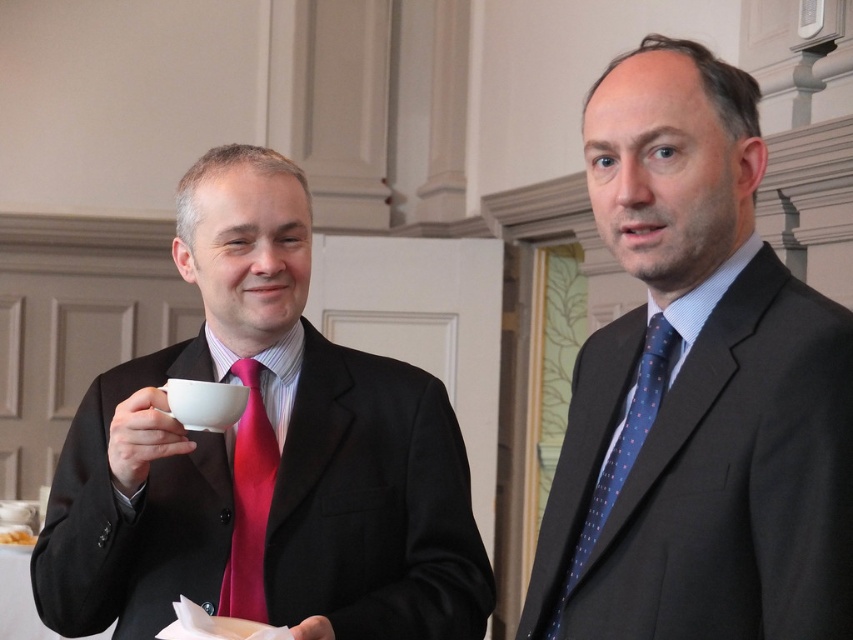
You are organizing a formal event and need to ensure that all attendees have ties of equal width. You notice two men in the image wearing the matte pink tie at left and the blue dotted fabric tie at right. Based on their current tie widths, which tie would require adjustment to match the other in width?

The matte pink tie at left is narrower than the blue dotted fabric tie at right. To match the required width, the matte pink tie at left would need to be adjusted to be wider, or the blue dotted fabric tie at right could be narrowed.